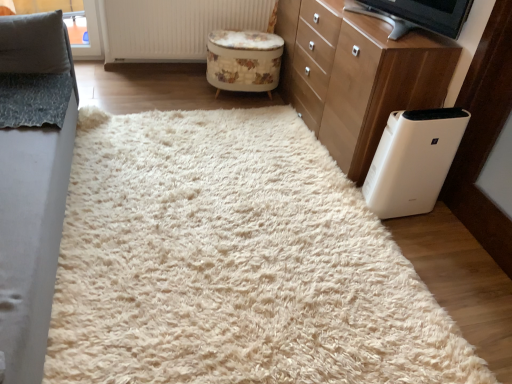
Question: Is the depth of white fluffy rug at center less than that of floral-patterned fabric stool at center?

Choices:
 (A) no
 (B) yes

Answer: (B)

Question: Would you consider white fluffy rug at center to be distant from floral-patterned fabric stool at center?

Choices:
 (A) no
 (B) yes

Answer: (B)

Question: Is white fluffy rug at center positioned with its back to floral-patterned fabric stool at center?

Choices:
 (A) yes
 (B) no

Answer: (B)

Question: Is white fluffy rug at center not within floral-patterned fabric stool at center?

Choices:
 (A) no
 (B) yes

Answer: (B)

Question: Considering the relative sizes of white fluffy rug at center and floral-patterned fabric stool at center in the image provided, is white fluffy rug at center bigger than floral-patterned fabric stool at center?

Choices:
 (A) yes
 (B) no

Answer: (A)

Question: From a real-world perspective, is floral-patterned fabric stool at center above or below white plastic tv at upper right?

Choices:
 (A) below
 (B) above

Answer: (A)

Question: Relative to white plastic tv at upper right, is floral-patterned fabric stool at center in front or behind?

Choices:
 (A) front
 (B) behind

Answer: (B)

Question: Does point (266, 81) appear closer or farther from the camera than point (402, 29)?

Choices:
 (A) closer
 (B) farther

Answer: (B)

Question: In the image, is floral-patterned fabric stool at center on the left side or the right side of white plastic tv at upper right?

Choices:
 (A) right
 (B) left

Answer: (B)

Question: From the image's perspective, is white fluffy rug at center located above or below white wood chest of drawers at right?

Choices:
 (A) above
 (B) below

Answer: (B)

Question: Is white fluffy rug at center inside the boundaries of white wood chest of drawers at right, or outside?

Choices:
 (A) outside
 (B) inside

Answer: (A)

Question: Does point (203, 236) appear closer or farther from the camera than point (313, 120)?

Choices:
 (A) closer
 (B) farther

Answer: (A)

Question: Relative to white wood chest of drawers at right, is white fluffy rug at center in front or behind?

Choices:
 (A) behind
 (B) front

Answer: (B)

Question: From the image's perspective, is white textured radiator at upper center located above or below white plastic air purifier at lower right?

Choices:
 (A) below
 (B) above

Answer: (B)

Question: Considering their positions, is white textured radiator at upper center located in front of or behind white plastic air purifier at lower right?

Choices:
 (A) behind
 (B) front

Answer: (A)